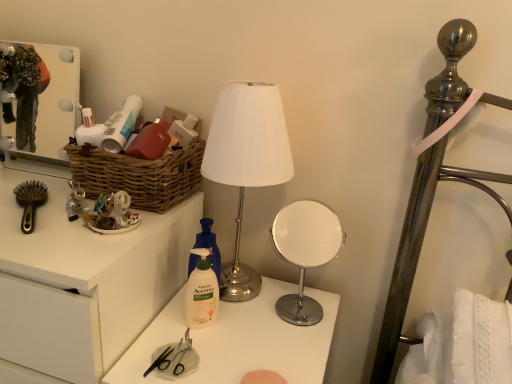
Where is `vacant area that lies between white glossy mirror at center right and metallic silver scissors at center`? Image resolution: width=512 pixels, height=384 pixels. vacant area that lies between white glossy mirror at center right and metallic silver scissors at center is located at coordinates (249, 335).